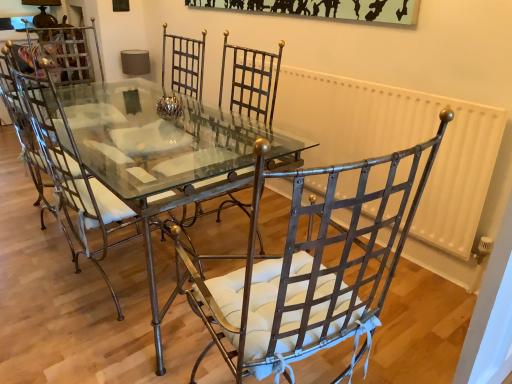
Question: Is matte metal chair at center, acting as the 1th chair starting from the left, thinner than metallic glass table at center?

Choices:
 (A) yes
 (B) no

Answer: (A)

Question: Considering the relative sizes of matte metal chair at center, which is counted as the second chair, starting from the right, and metallic glass table at center in the image provided, is matte metal chair at center, which is counted as the second chair, starting from the right, shorter than metallic glass table at center?

Choices:
 (A) no
 (B) yes

Answer: (A)

Question: Is matte metal chair at center, which is counted as the second chair, starting from the right, in contact with metallic glass table at center?

Choices:
 (A) yes
 (B) no

Answer: (B)

Question: Does matte metal chair at center, which is counted as the second chair, starting from the right, have a smaller size compared to metallic glass table at center?

Choices:
 (A) yes
 (B) no

Answer: (A)

Question: Can you confirm if matte metal chair at center, acting as the 1th chair starting from the left, is positioned to the left of metallic glass table at center?

Choices:
 (A) no
 (B) yes

Answer: (B)

Question: Looking at the image, does matte metal chair at center, acting as the 1th chair starting from the left, seem bigger or smaller compared to white painted metal radiator at right?

Choices:
 (A) big
 (B) small

Answer: (A)

Question: Is matte metal chair at center, which is counted as the second chair, starting from the right, taller or shorter than white painted metal radiator at right?

Choices:
 (A) tall
 (B) short

Answer: (A)

Question: Is point (60, 170) positioned closer to the camera than point (313, 112)?

Choices:
 (A) farther
 (B) closer

Answer: (B)

Question: Is matte metal chair at center, acting as the 1th chair starting from the left, wider or thinner than white painted metal radiator at right?

Choices:
 (A) thin
 (B) wide

Answer: (B)

Question: Is metallic woven chair at center, placed as the 2th chair when sorted from left to right, taller or shorter than white painted metal radiator at right?

Choices:
 (A) short
 (B) tall

Answer: (B)

Question: In the image, is metallic woven chair at center, which is counted as the 1th chair, starting from the right, on the left side or the right side of white painted metal radiator at right?

Choices:
 (A) left
 (B) right

Answer: (A)

Question: Looking at the image, does metallic woven chair at center, placed as the 2th chair when sorted from left to right, seem bigger or smaller compared to white painted metal radiator at right?

Choices:
 (A) small
 (B) big

Answer: (B)

Question: From a real-world perspective, is metallic woven chair at center, which is counted as the 1th chair, starting from the right, positioned above or below white painted metal radiator at right?

Choices:
 (A) above
 (B) below

Answer: (A)

Question: Based on their sizes in the image, would you say metallic woven chair at center, which is counted as the 1th chair, starting from the right, is bigger or smaller than matte metal chair at center, which is counted as the second chair, starting from the right?

Choices:
 (A) small
 (B) big

Answer: (A)

Question: Considering the positions of point (371, 329) and point (86, 173), is point (371, 329) closer or farther from the camera than point (86, 173)?

Choices:
 (A) closer
 (B) farther

Answer: (A)